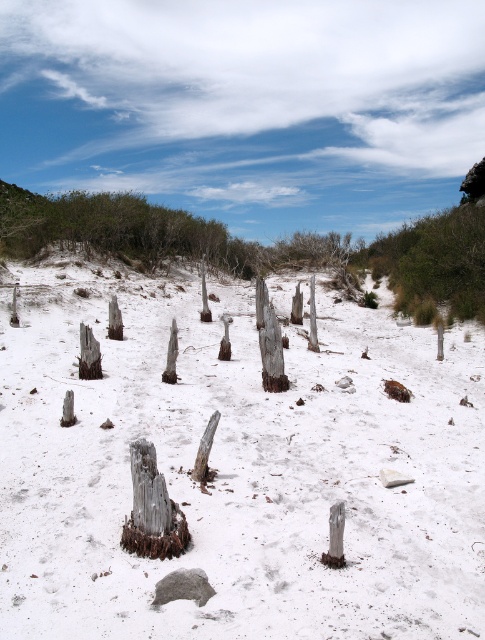
Question: Can you confirm if white sandy beach at center is smaller than weathered wood tree trunk at center?

Choices:
 (A) no
 (B) yes

Answer: (A)

Question: Which point is farther to the camera?

Choices:
 (A) white sandy beach at center
 (B) weathered wood tree trunk at center

Answer: (B)

Question: Which point appears closest to the camera in this image?

Choices:
 (A) (333, 452)
 (B) (271, 333)

Answer: (A)

Question: Can you confirm if white sandy beach at center is positioned to the left of weathered wood tree trunk at center?

Choices:
 (A) no
 (B) yes

Answer: (B)

Question: Can you confirm if white sandy beach at center is positioned to the left of weathered wood tree trunk at center?

Choices:
 (A) yes
 (B) no

Answer: (A)